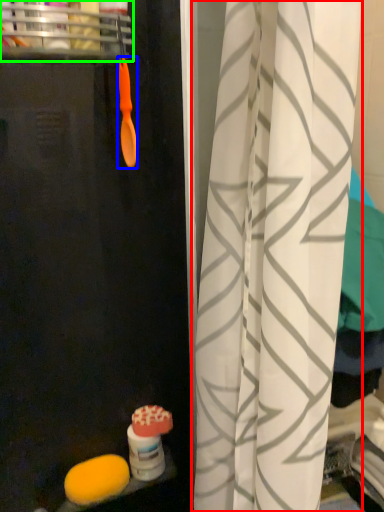
Question: Which object is the farthest from curtain (highlighted by a red box)? Choose among these: brush (highlighted by a blue box) or shelf (highlighted by a green box).

Choices:
 (A) brush
 (B) shelf

Answer: (B)